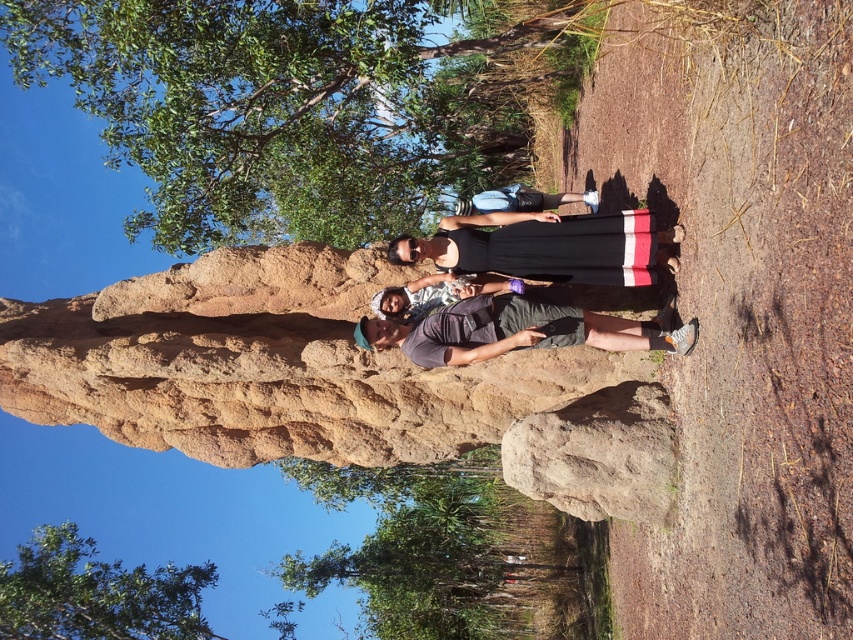
You are standing at the center of the image and want to take a photo of the group of four individuals near the termite mound. However, you notice that the green leafy tree at lower center is blocking your view. To avoid the tree, should you move left or right?

The green leafy tree at lower center is located at point 0.855 on the x axis, which is to the right side of the image. To avoid the tree, you should move to the left.